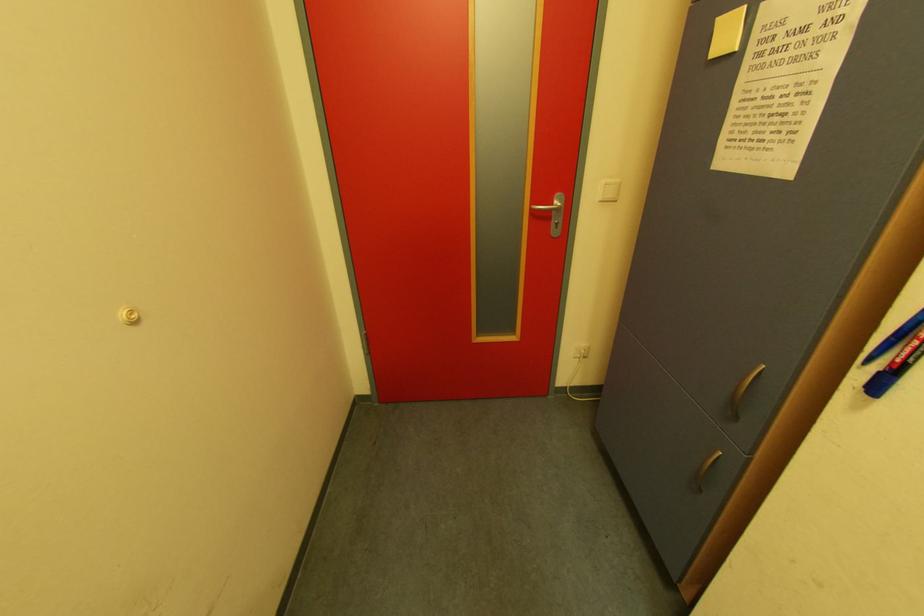
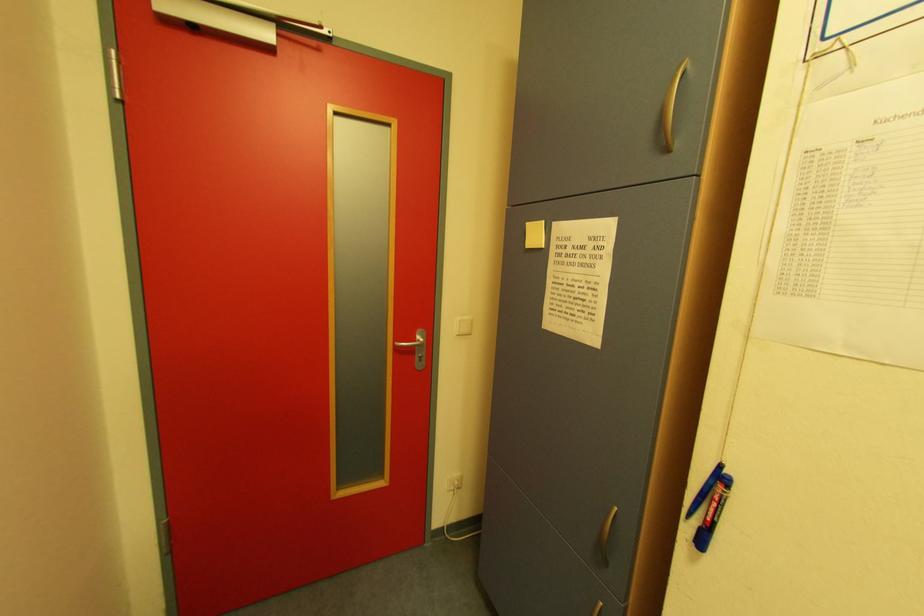
How did the camera likely rotate?

The camera's rotation is toward right-up.